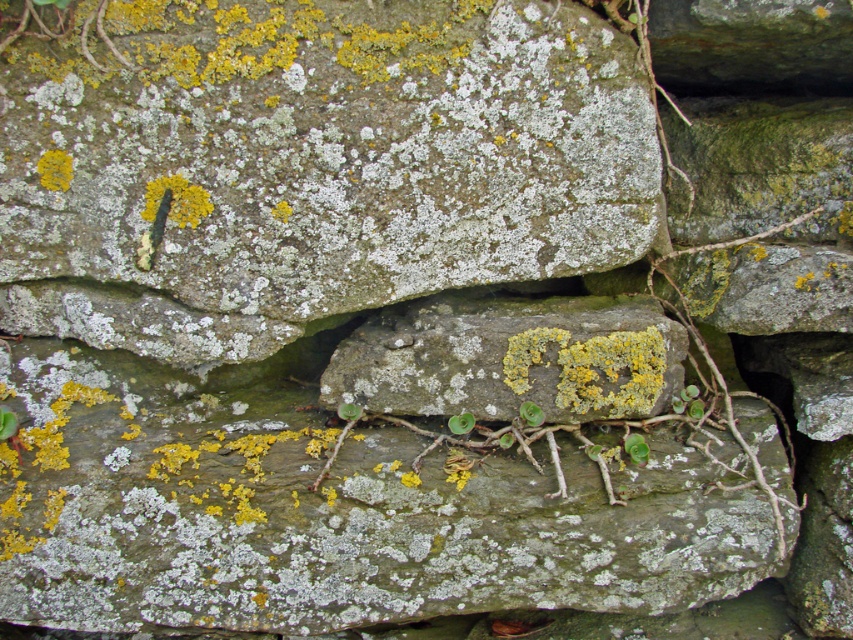
Does yellow lichen at upper left have a larger size compared to green leafy plant at center?

Yes, yellow lichen at upper left is bigger than green leafy plant at center.

Which is more to the right, yellow lichen at upper left or green leafy plant at center?

From the viewer's perspective, green leafy plant at center appears more on the right side.

Which is behind, point (45, 172) or point (469, 428)?

The point (469, 428) is more distant.

At what (x,y) coordinates should I click in order to perform the action: click on yellow lichen at upper left. Please return your answer as a coordinate pair (x, y). Looking at the image, I should click on (55, 170).

Is the position of speckled stone at center less distant than that of yellow lichen-covered rock at center?

That is True.

Does speckled stone at center have a greater width compared to yellow lichen-covered rock at center?

Correct, the width of speckled stone at center exceeds that of yellow lichen-covered rock at center.

Where is `speckled stone at center`? Image resolution: width=853 pixels, height=640 pixels. speckled stone at center is located at coordinates (308, 163).

Where is `speckled stone at center`? speckled stone at center is located at coordinates (308, 163).

Which is above, yellow lichen-covered rock at center or green succulent at center?

yellow lichen-covered rock at center

Who is more forward, (x=509, y=330) or (x=648, y=449)?

Positioned in front is point (x=509, y=330).

Describe the element at coordinates (511, 356) in the screenshot. I see `yellow lichen-covered rock at center` at that location.

Find the location of a particular element. yellow lichen-covered rock at center is located at coordinates (511, 356).